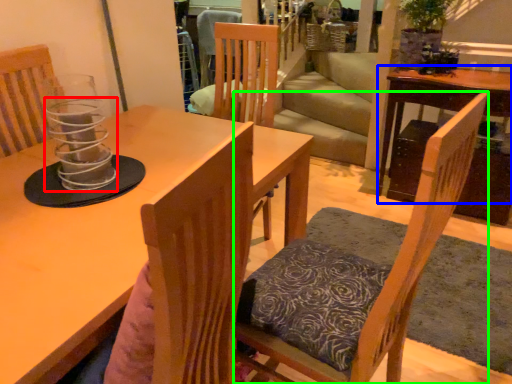
Question: Which object is positioned closest to candle holder (highlighted by a red box)? Select from table (highlighted by a blue box) and chair (highlighted by a green box).

Choices:
 (A) table
 (B) chair

Answer: (B)